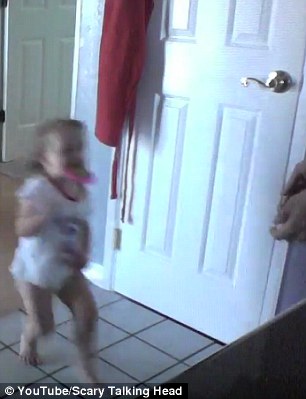
Find the location of a particular element. The height and width of the screenshot is (399, 306). door lever is located at coordinates (253, 78).